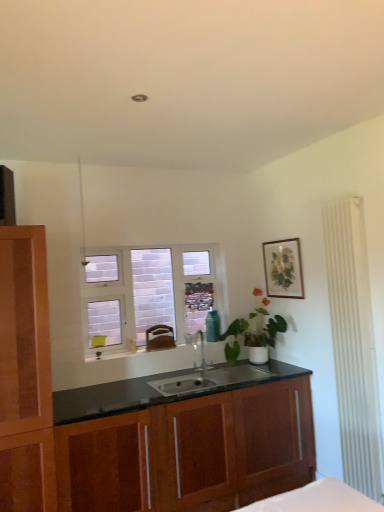
Question: Does matte wooden picture frame at upper right come behind satin nickel faucet at center?

Choices:
 (A) no
 (B) yes

Answer: (B)

Question: From a real-world perspective, is matte wooden picture frame at upper right over satin nickel faucet at center?

Choices:
 (A) yes
 (B) no

Answer: (A)

Question: Is satin nickel faucet at center a part of matte wooden picture frame at upper right?

Choices:
 (A) no
 (B) yes

Answer: (A)

Question: Considering the relative sizes of matte wooden picture frame at upper right and satin nickel faucet at center in the image provided, is matte wooden picture frame at upper right wider than satin nickel faucet at center?

Choices:
 (A) yes
 (B) no

Answer: (B)

Question: Does matte wooden picture frame at upper right have a smaller size compared to satin nickel faucet at center?

Choices:
 (A) yes
 (B) no

Answer: (A)

Question: Can you confirm if matte wooden picture frame at upper right is bigger than satin nickel faucet at center?

Choices:
 (A) no
 (B) yes

Answer: (A)

Question: Is white frosted glass window at center further to camera compared to satin nickel faucet at center?

Choices:
 (A) no
 (B) yes

Answer: (B)

Question: Can you confirm if white frosted glass window at center is wider than satin nickel faucet at center?

Choices:
 (A) no
 (B) yes

Answer: (A)

Question: Is white frosted glass window at center outside satin nickel faucet at center?

Choices:
 (A) no
 (B) yes

Answer: (B)

Question: Is white frosted glass window at center positioned with its back to satin nickel faucet at center?

Choices:
 (A) no
 (B) yes

Answer: (A)

Question: From a real-world perspective, is white frosted glass window at center on top of satin nickel faucet at center?

Choices:
 (A) yes
 (B) no

Answer: (A)

Question: From the image's perspective, would you say white frosted glass window at center is shown under satin nickel faucet at center?

Choices:
 (A) no
 (B) yes

Answer: (A)

Question: Does wooden cabinet at center have a greater height compared to white frosted glass window at center?

Choices:
 (A) no
 (B) yes

Answer: (A)